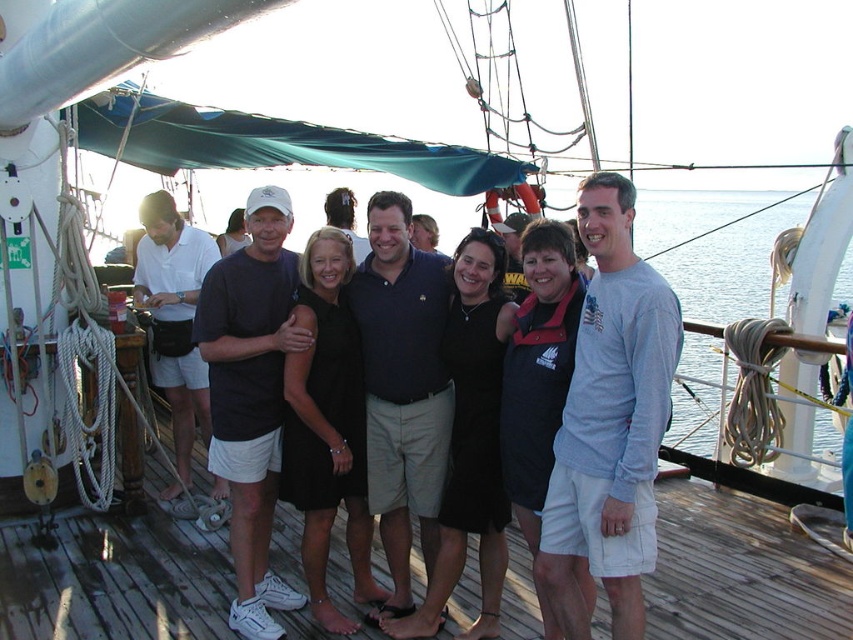
Which is in front, point (596, 502) or point (392, 232)?

Positioned in front is point (596, 502).

Does light blue long-sleeve shirt at center have a greater width compared to dark blue polo shirt at center?

Yes, light blue long-sleeve shirt at center is wider than dark blue polo shirt at center.

The height and width of the screenshot is (640, 853). Describe the element at coordinates (610, 420) in the screenshot. I see `light blue long-sleeve shirt at center` at that location.

You are a GUI agent. You are given a task and a screenshot of the screen. Output one action in this format:
    pyautogui.click(x=<x>, y=<y>)
    Task: Click on the light blue long-sleeve shirt at center
    Image resolution: width=853 pixels, height=640 pixels.
    Given the screenshot: What is the action you would take?
    pyautogui.click(x=610, y=420)

Is point (839, 620) behind point (637, 632)?

Yes.

Who is positioned more to the left, wooden deck at center or dark blue shirt at center?

Positioned to the left is dark blue shirt at center.

Describe the element at coordinates (114, 580) in the screenshot. I see `wooden deck at center` at that location.

I want to click on wooden deck at center, so click(x=114, y=580).

Is point (387, 218) positioned in front of point (186, 253)?

That is True.

Does point (379, 200) come in front of point (183, 474)?

Yes.

Where is `dark blue polo shirt at center`? dark blue polo shirt at center is located at coordinates (402, 388).